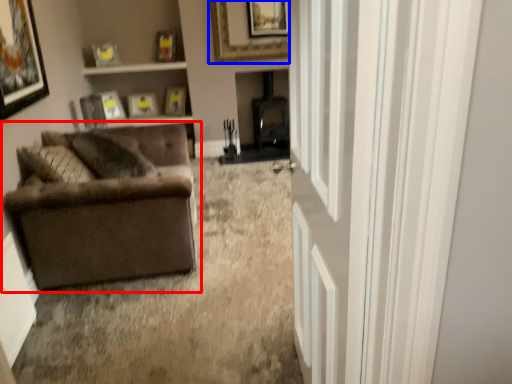
Question: Which point is further to the camera, studio couch (highlighted by a red box) or picture frame (highlighted by a blue box)?

Choices:
 (A) studio couch
 (B) picture frame

Answer: (B)